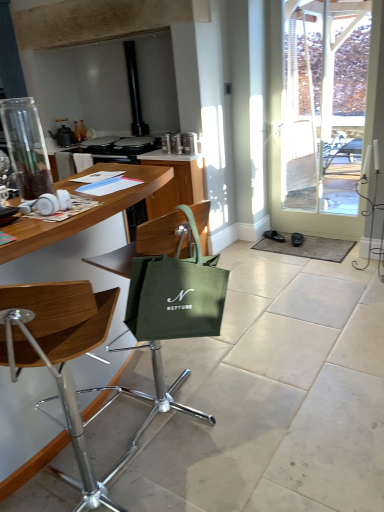
Question: Considering the relative positions of clear glass jar at left and green fabric cabinet at center in the image provided, is clear glass jar at left to the right of green fabric cabinet at center from the viewer's perspective?

Choices:
 (A) no
 (B) yes

Answer: (A)

Question: Is clear glass jar at left outside green fabric cabinet at center?

Choices:
 (A) no
 (B) yes

Answer: (B)

Question: Is clear glass jar at left oriented away from green fabric cabinet at center?

Choices:
 (A) no
 (B) yes

Answer: (A)

Question: Considering the relative positions of clear glass jar at left and green fabric cabinet at center in the image provided, is clear glass jar at left behind green fabric cabinet at center?

Choices:
 (A) no
 (B) yes

Answer: (A)

Question: Is clear glass jar at left shorter than green fabric cabinet at center?

Choices:
 (A) no
 (B) yes

Answer: (B)

Question: Is green fabric cabinet at center spatially inside black leather shoe at lower right, the 2th footwear from the left, or outside of it?

Choices:
 (A) outside
 (B) inside

Answer: (A)

Question: Visually, is green fabric cabinet at center positioned to the left or to the right of black leather shoe at lower right, the 2th footwear from the left?

Choices:
 (A) left
 (B) right

Answer: (A)

Question: From a real-world perspective, is green fabric cabinet at center positioned above or below black leather shoe at lower right, the 2th footwear from the left?

Choices:
 (A) below
 (B) above

Answer: (B)

Question: Considering the positions of green fabric cabinet at center and black leather shoe at lower right, the 2th footwear from the left, in the image, is green fabric cabinet at center wider or thinner than black leather shoe at lower right, the 2th footwear from the left,?

Choices:
 (A) thin
 (B) wide

Answer: (B)

Question: Which is correct: woodenmaterial/texturetable at left is inside black leather shoe at lower right, the 2th footwear positioned from the right, or outside of it?

Choices:
 (A) inside
 (B) outside

Answer: (B)

Question: Is point (8, 249) positioned closer to the camera than point (276, 240)?

Choices:
 (A) closer
 (B) farther

Answer: (A)

Question: From a real-world perspective, is woodenmaterial/texturetable at left physically located above or below black leather shoe at lower right, the 2th footwear positioned from the right?

Choices:
 (A) below
 (B) above

Answer: (B)

Question: In terms of size, does woodenmaterial/texturetable at left appear bigger or smaller than black leather shoe at lower right, placed as the first footwear when sorted from left to right?

Choices:
 (A) big
 (B) small

Answer: (A)

Question: Based on their positions, is woodenmaterial/texturetable at left located to the left or right of black leather shoe at lower right, the 2th footwear from the left?

Choices:
 (A) right
 (B) left

Answer: (B)

Question: Is woodenmaterial/texturetable at left situated inside black leather shoe at lower right, the 2th footwear from the left, or outside?

Choices:
 (A) outside
 (B) inside

Answer: (A)